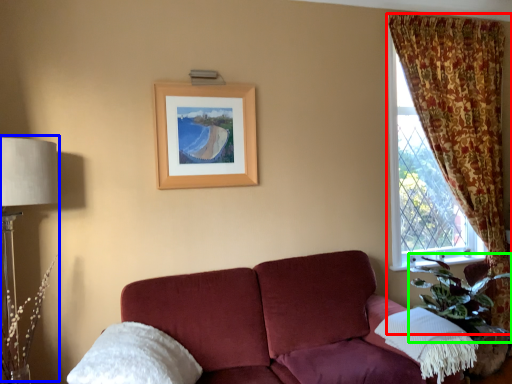
Question: Which is farther away from curtain (highlighted by a red box)? table lamp (highlighted by a blue box) or plant (highlighted by a green box)?

Choices:
 (A) table lamp
 (B) plant

Answer: (A)